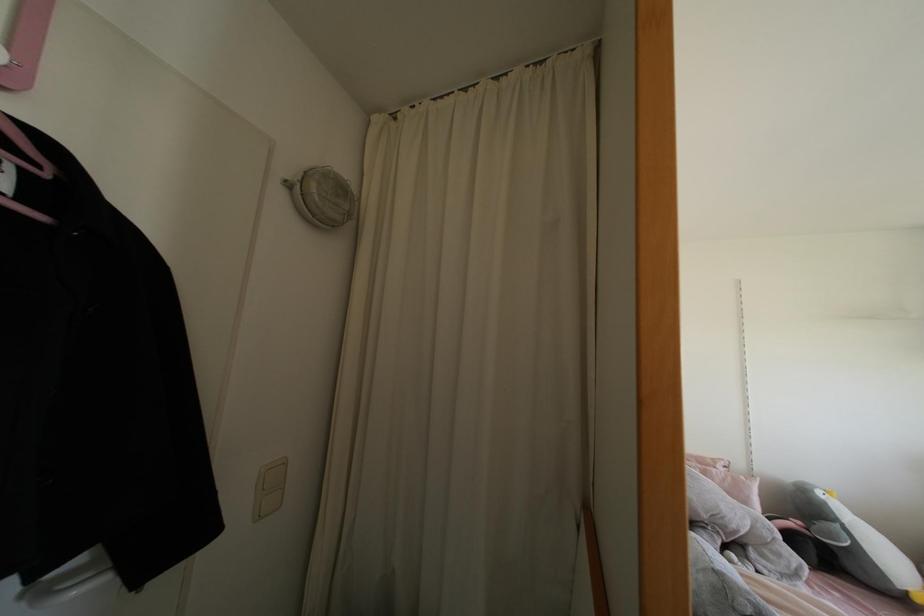
Describe the element at coordinates (854, 541) in the screenshot. I see `the grey plush pillow` at that location.